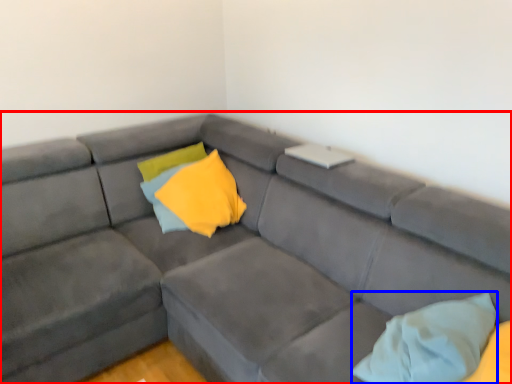
Question: Which point is further to the camera, studio couch (highlighted by a red box) or pillow (highlighted by a blue box)?

Choices:
 (A) studio couch
 (B) pillow

Answer: (B)